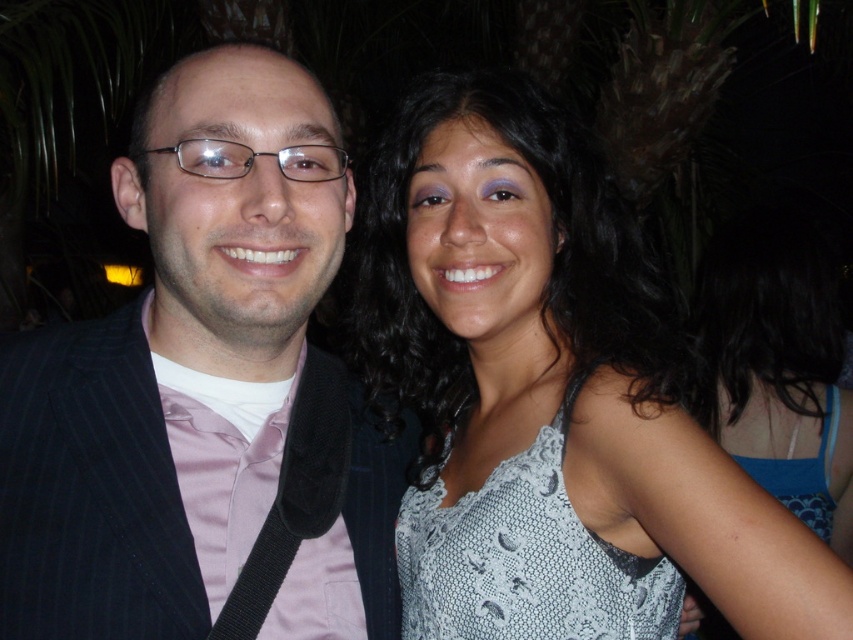
Who is lower down, black pinstripe suit at left or blue lace tank top at upper right?

blue lace tank top at upper right

Who is positioned more to the right, black pinstripe suit at left or blue lace tank top at upper right?

blue lace tank top at upper right is more to the right.

Is point (106, 364) less distant than point (724, 317)?

Yes, point (106, 364) is closer to viewer.

Identify the location of black pinstripe suit at left. Image resolution: width=853 pixels, height=640 pixels. (204, 392).

Does point (171, 81) lie in front of point (640, 564)?

Yes.

Locate an element on the screen. The width and height of the screenshot is (853, 640). black pinstripe suit at left is located at coordinates (204, 392).

Who is more distant from viewer, (422,540) or (751,285)?

The point (751,285) is more distant.

Does white lace tank top at upper right appear under blue lace tank top at upper right?

Actually, white lace tank top at upper right is above blue lace tank top at upper right.

Find the location of a particular element. white lace tank top at upper right is located at coordinates [x=554, y=397].